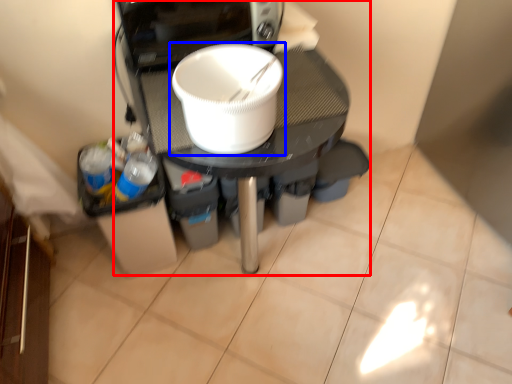
Question: Among these objects, which one is farthest to the camera, appliance (highlighted by a red box) or tableware (highlighted by a blue box)?

Choices:
 (A) appliance
 (B) tableware

Answer: (A)